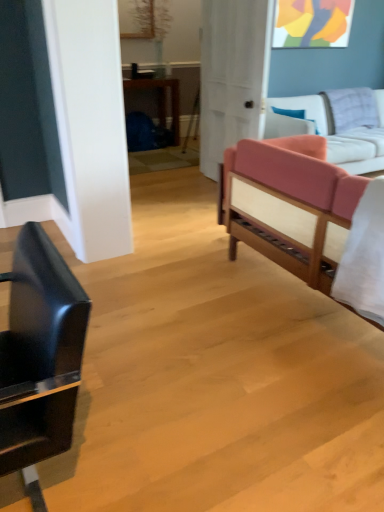
Locate an element on the screen. vacant space underneath white cotton sheet at right (from a real-world perspective) is located at coordinates (348, 362).